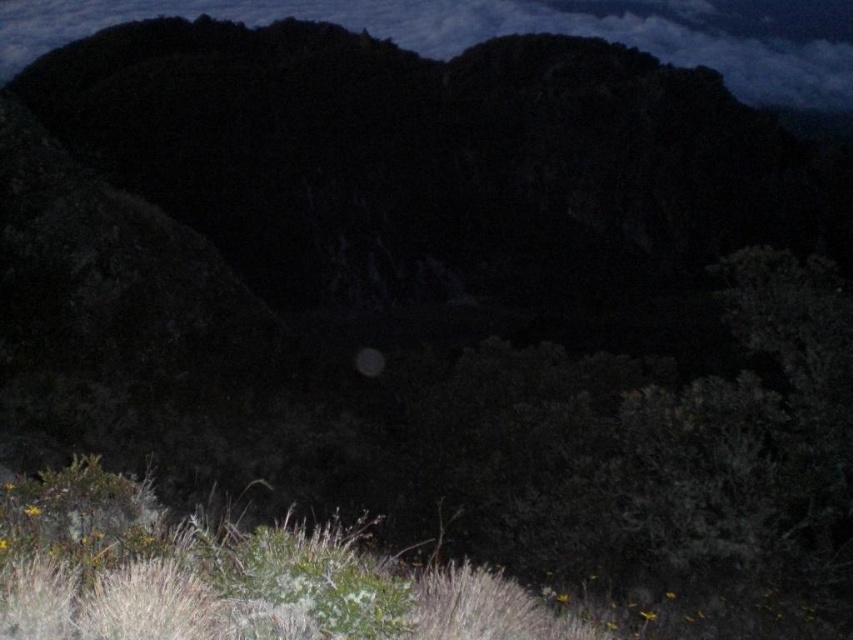
Can you confirm if cloudy sky at upper center is positioned to the left of gray matte moon at center?

No, cloudy sky at upper center is not to the left of gray matte moon at center.

The width and height of the screenshot is (853, 640). Describe the element at coordinates (521, 32) in the screenshot. I see `cloudy sky at upper center` at that location.

The image size is (853, 640). I want to click on cloudy sky at upper center, so click(x=521, y=32).

Image resolution: width=853 pixels, height=640 pixels. I want to click on cloudy sky at upper center, so click(521, 32).